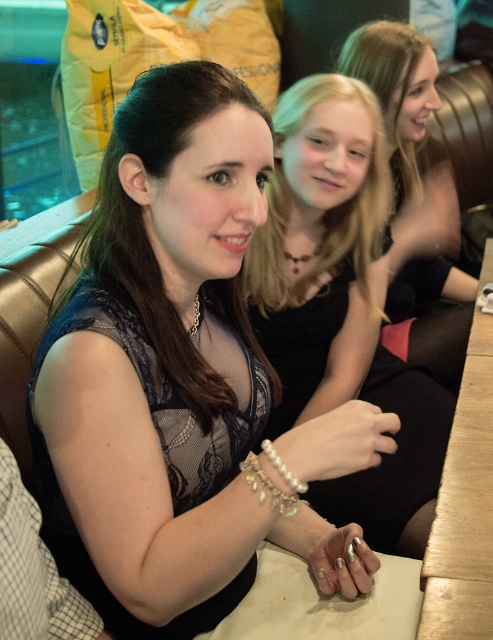
Question: Which point is closer to the camera taking this photo?

Choices:
 (A) (83, 237)
 (B) (275, 465)
 (C) (393, 243)

Answer: (B)

Question: Which point is farther from the camera taking this photo?

Choices:
 (A) (422, 472)
 (B) (189, 189)
 (C) (410, 328)
 (D) (259, 467)

Answer: (C)

Question: From the image, what is the correct spatial relationship of matte black dress at center in relation to pearl-like beaded bracelet at center?

Choices:
 (A) below
 (B) above

Answer: (B)

Question: Based on their relative distances, which object is farther from the matte black dress at center?

Choices:
 (A) pearl/textured bracelet at lower center
 (B) pearl-like beaded bracelet at center
 (C) black lace dress at center

Answer: (C)

Question: Does matte black dress at center appear over smooth black dress at center?

Choices:
 (A) yes
 (B) no

Answer: (B)

Question: Does black lace dress at center appear over smooth black dress at center?

Choices:
 (A) no
 (B) yes

Answer: (A)